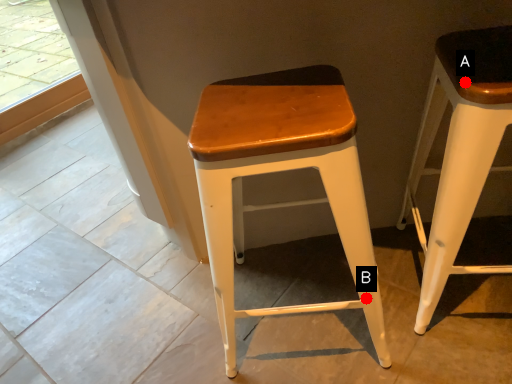
Question: Two points are circled on the image, labeled by A and B beside each circle. Which point appears farthest from the camera in this image?

Choices:
 (A) A is further
 (B) B is further

Answer: (B)